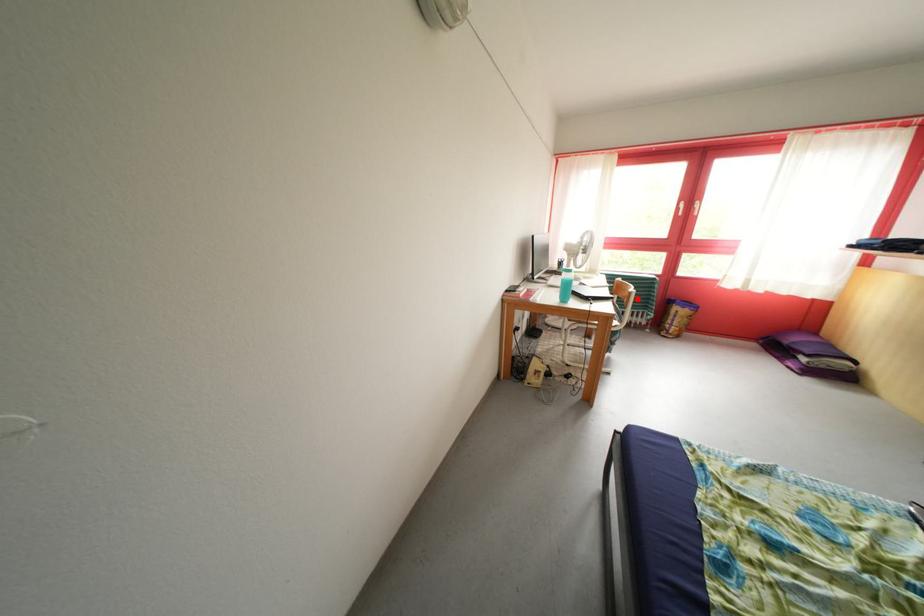
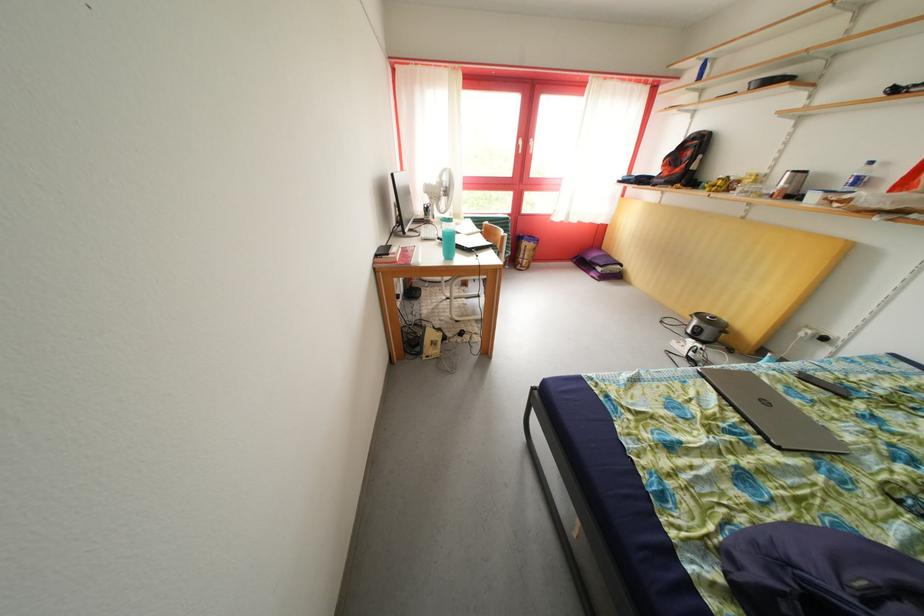
Find the pixel in the second image that matches the highlighted location in the first image.

(511, 243)